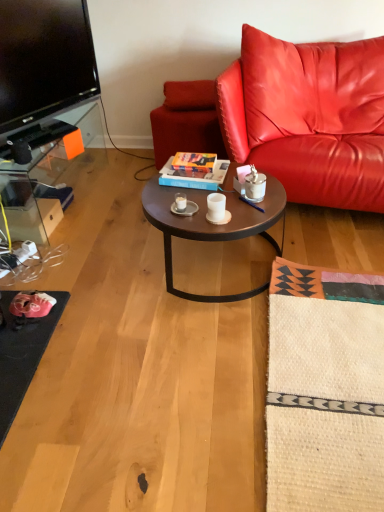
Where is `free region on the left part of white ceramic mug at center, which appears as the 2th coffee cup when viewed from the right`? free region on the left part of white ceramic mug at center, which appears as the 2th coffee cup when viewed from the right is located at coordinates (161, 205).